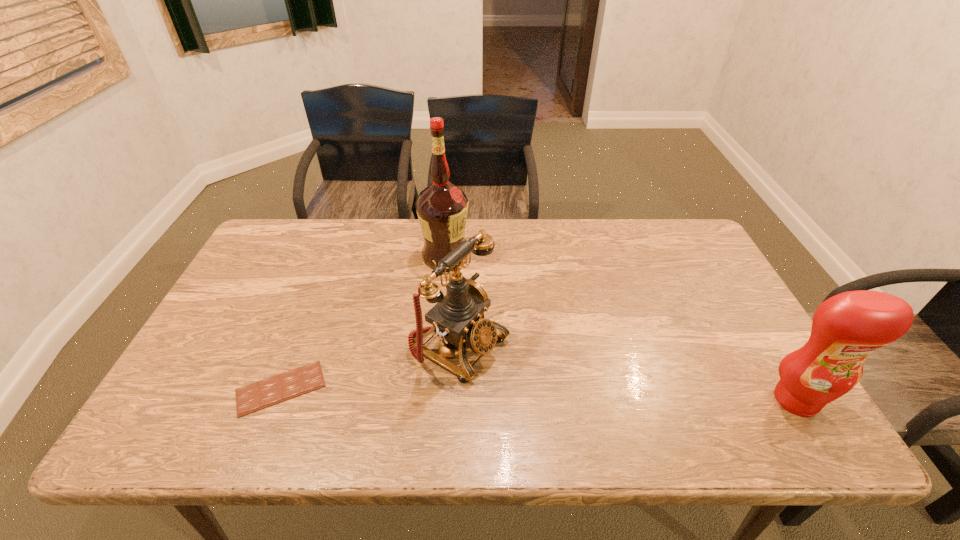
The height and width of the screenshot is (540, 960). I want to click on free space on the desktop that is between the shortest object and the condiment and is positioned on the label of the alcohol, so click(x=567, y=395).

The image size is (960, 540). Find the location of `free space on the desktop that is between the leftmost object and the rightmost object and is positioned on the front of the telephone, featuring the rotary dial`. free space on the desktop that is between the leftmost object and the rightmost object and is positioned on the front of the telephone, featuring the rotary dial is located at coordinates (549, 394).